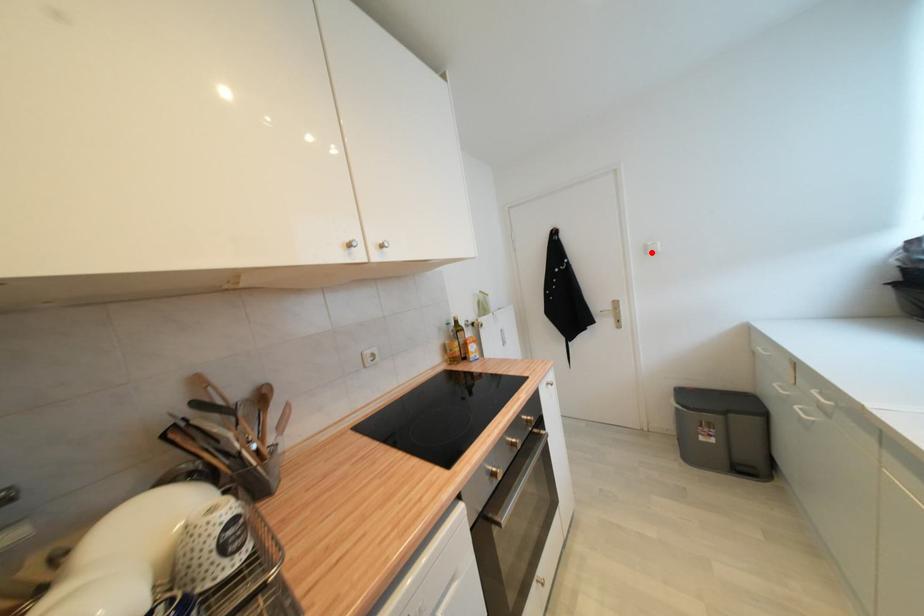
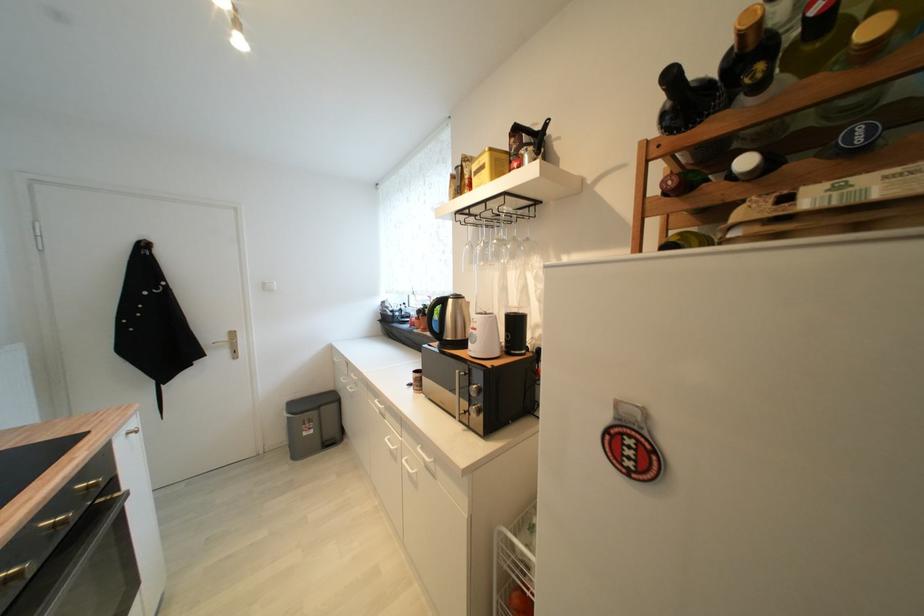
Locate, in the second image, the point that corresponds to the highlighted location in the first image.

(271, 289)